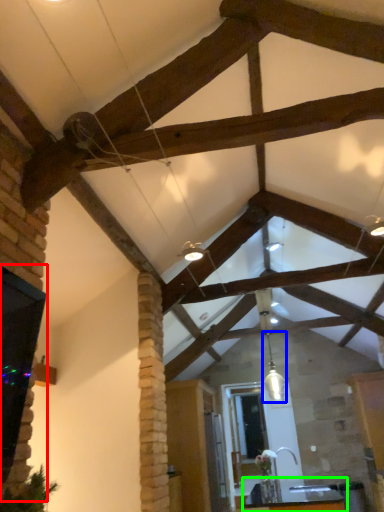
Question: Which object is the closest to the window (highlighted by a red box)? Choose among these: light fixture (highlighted by a blue box) or table (highlighted by a green box).

Choices:
 (A) light fixture
 (B) table

Answer: (A)